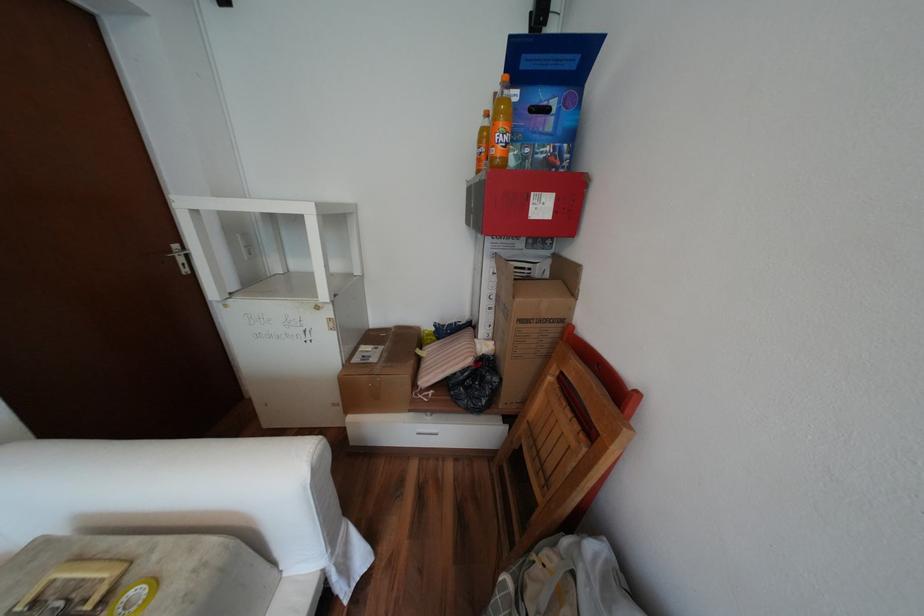
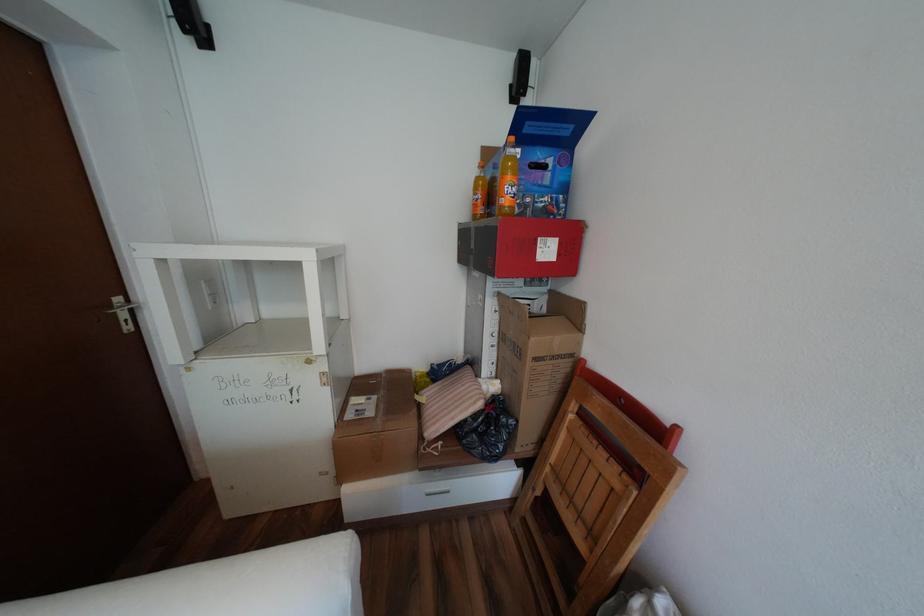
Find the pixel in the second image that matches point (552, 207) in the first image.

(556, 251)